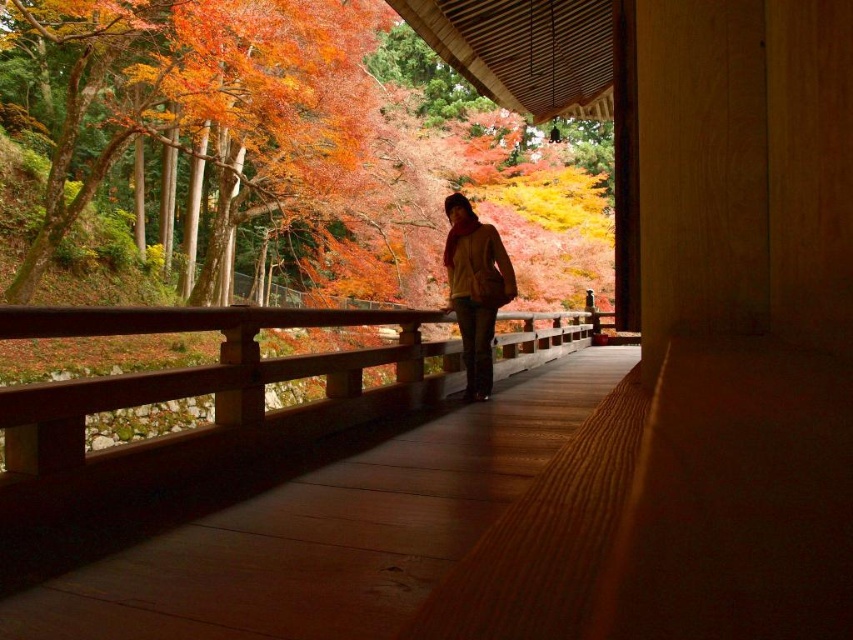
Question: Is matte yellow sweater at center smaller than matte yellow jacket at center?

Choices:
 (A) no
 (B) yes

Answer: (A)

Question: Estimate the real-world distances between objects in this image. Which object is farther from the autumn leaves at upper left?

Choices:
 (A) wooden walkway at center
 (B) matte yellow jacket at center
 (C) matte yellow sweater at center

Answer: (A)

Question: Which point is closer to the camera taking this photo?

Choices:
 (A) (341, 541)
 (B) (503, 284)
 (C) (453, 244)
 (D) (520, 104)

Answer: (A)

Question: Is wooden walkway at center smaller than autumn leaves at upper left?

Choices:
 (A) no
 (B) yes

Answer: (B)

Question: Which object is farther from the camera taking this photo?

Choices:
 (A) autumn leaves at upper left
 (B) matte yellow sweater at center
 (C) matte yellow jacket at center
 (D) wooden walkway at center

Answer: (A)

Question: Can you confirm if matte yellow sweater at center is bigger than matte yellow jacket at center?

Choices:
 (A) no
 (B) yes

Answer: (B)